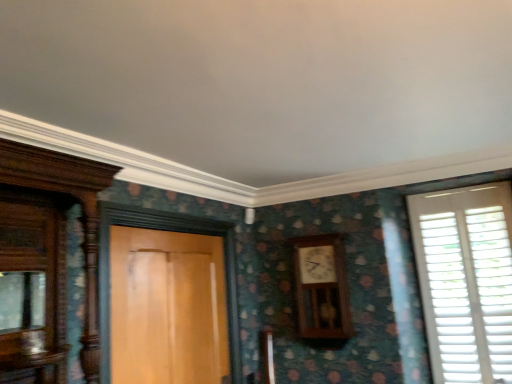
Question: Considering the relative positions of wooden clock at center-right and wooden door at center in the image provided, is wooden clock at center-right to the left or to the right of wooden door at center?

Choices:
 (A) right
 (B) left

Answer: (A)

Question: Choose the correct answer: Is wooden clock at center-right inside wooden door at center or outside it?

Choices:
 (A) outside
 (B) inside

Answer: (A)

Question: Which object is positioned farthest from the wooden door at center?

Choices:
 (A) wooden clock at center-right
 (B) white wooden shutters at right

Answer: (B)

Question: Estimate the real-world distances between objects in this image. Which object is farther from the wooden clock at center-right?

Choices:
 (A) white wooden shutters at right
 (B) wooden door at center

Answer: (B)